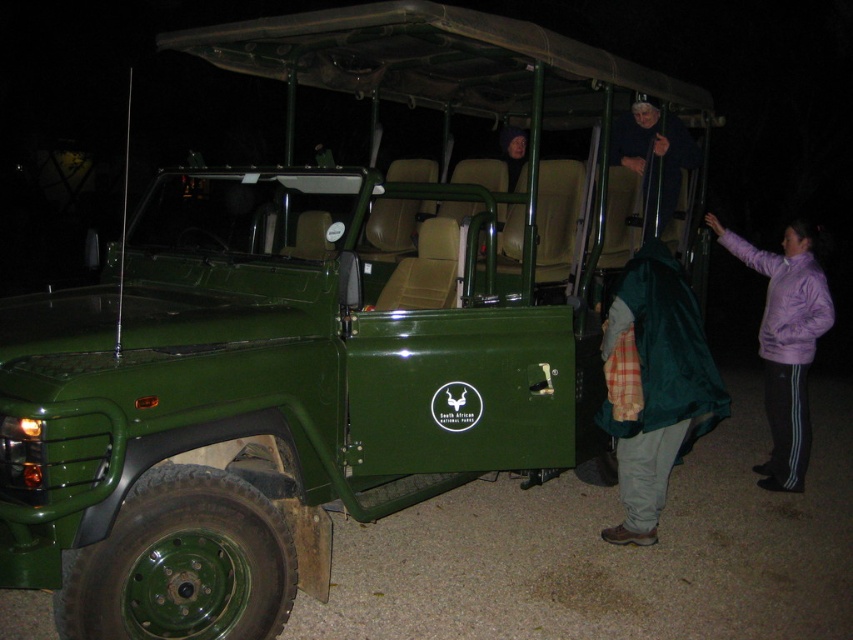
Between point (802, 352) and point (631, 145), which one is positioned in front?

Point (802, 352) is more forward.

Does purple fleece jacket at right appear over dark blue sweater at upper center?

No, purple fleece jacket at right is not above dark blue sweater at upper center.

Is point (776, 428) positioned behind point (671, 172)?

That is False.

Where is `purple fleece jacket at right`? purple fleece jacket at right is located at coordinates (785, 342).